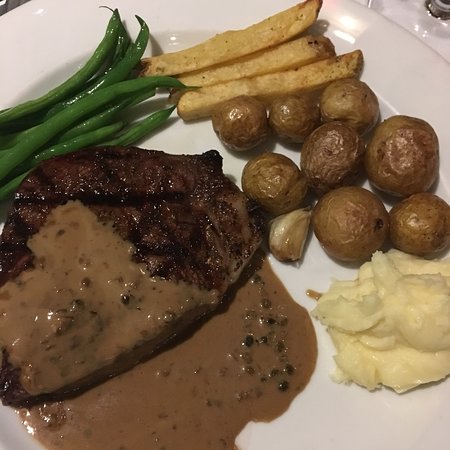
You are a GUI agent. You are given a task and a screenshot of the screen. Output one action in this format:
    pyautogui.click(x=<x>, y=<y>)
    Task: Click on the rim of plate
    This screenshot has height=450, width=450.
    Given the screenshot: What is the action you would take?
    pyautogui.click(x=212, y=6)